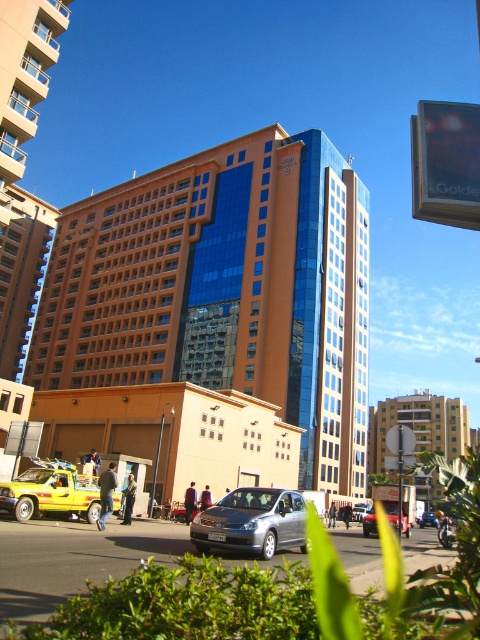
Question: Considering the relative positions of yellow matte building at center and silver metallic car at center in the image provided, where is yellow matte building at center located with respect to silver metallic car at center?

Choices:
 (A) left
 (B) right

Answer: (B)

Question: Which is farther from the yellow matte taxi at lower left?

Choices:
 (A) yellow matte building at center
 (B) metallic silver sedan at center
 (C) satin silver car at center
 (D) silver metallic car at center

Answer: (A)

Question: Based on their relative distances, which object is farther from the metallic silver sedan at center?

Choices:
 (A) yellow matte building at center
 (B) yellow matte taxi at lower left

Answer: (A)

Question: Does satin silver car at center come behind yellow matte taxi at lower left?

Choices:
 (A) no
 (B) yes

Answer: (A)

Question: Which is nearer to the satin silver car at center?

Choices:
 (A) metallic silver sedan at center
 (B) yellow matte building at center
 (C) silver metallic car at center

Answer: (A)

Question: From the image, what is the correct spatial relationship of metallic silver sedan at center in relation to silver metallic sedan at center?

Choices:
 (A) above
 (B) below

Answer: (A)